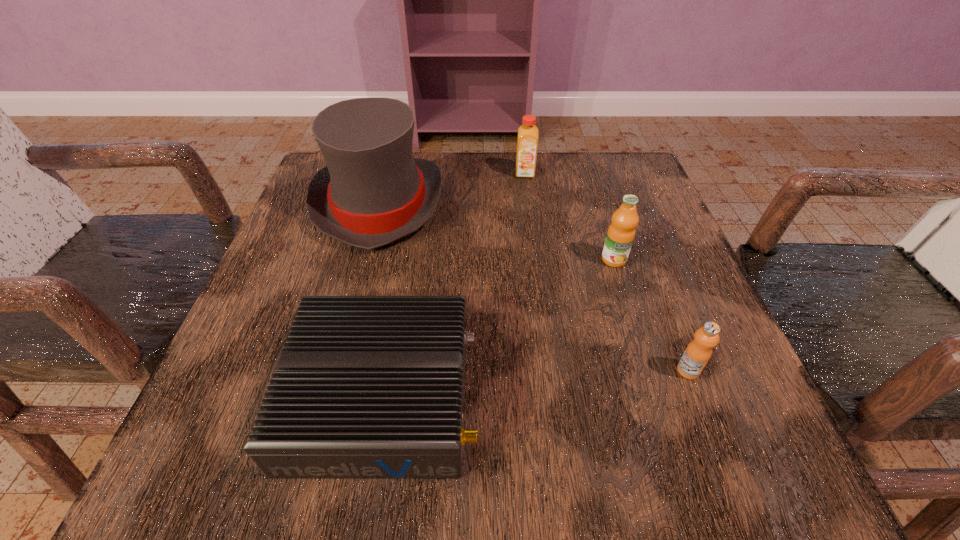
Where is `free spot located 0.260m on the front and back of the leftmost orange juice`? Image resolution: width=960 pixels, height=540 pixels. free spot located 0.260m on the front and back of the leftmost orange juice is located at coordinates (536, 256).

Locate an element on the screen. Image resolution: width=960 pixels, height=540 pixels. vacant space located on the front label of the rightmost orange juice is located at coordinates (708, 419).

You are a GUI agent. You are given a task and a screenshot of the screen. Output one action in this format:
    pyautogui.click(x=<x>, y=<y>)
    Task: Click on the free space located 0.190m on the back panel of the shortest object
    
    Given the screenshot: What is the action you would take?
    pyautogui.click(x=614, y=396)

Locate an element on the screen. Image resolution: width=960 pixels, height=540 pixels. dress hat positioned at the far edge is located at coordinates (372, 192).

Where is `orange juice that is at the far edge`? The width and height of the screenshot is (960, 540). orange juice that is at the far edge is located at coordinates (527, 143).

You are a GUI agent. You are given a task and a screenshot of the screen. Output one action in this format:
    pyautogui.click(x=<x>, y=<y>)
    Task: Click on the object that is at the near edge
    
    Given the screenshot: What is the action you would take?
    pyautogui.click(x=365, y=386)

This screenshot has width=960, height=540. I want to click on dress hat that is at the left edge, so click(372, 192).

The height and width of the screenshot is (540, 960). Identify the location of router present at the left edge. (365, 386).

Find the location of a particular element. This screenshot has width=960, height=540. object situated at the far left corner is located at coordinates (372, 192).

Identify the location of object at the near left corner. (365, 386).